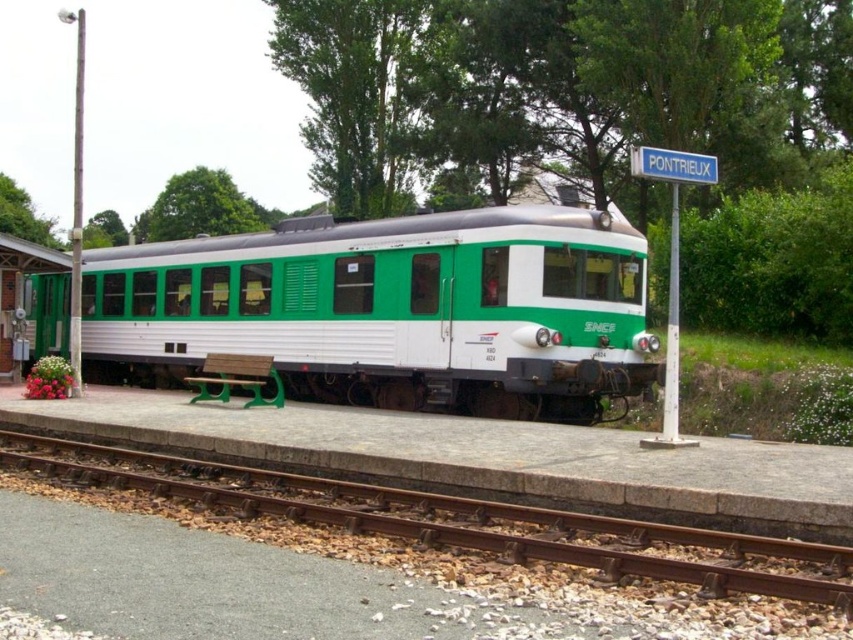
You are a maintenance worker checking the train and track. The green matte train at center is currently on the rusty metal track at lower left. Is the train properly aligned with the track?

The green matte train at center is positioned over the rusty metal track at lower left, so the train is properly aligned with the track.

You are a maintenance worker at the train station. You need to determine if the green matte train at center can fit entirely on the rusty metal track at lower left. Based on their widths, can it fit?

The green matte train at center might be wider than rusty metal track at lower left, so there is a possibility that it cannot fit entirely on the track due to its potential width exceeding the track.